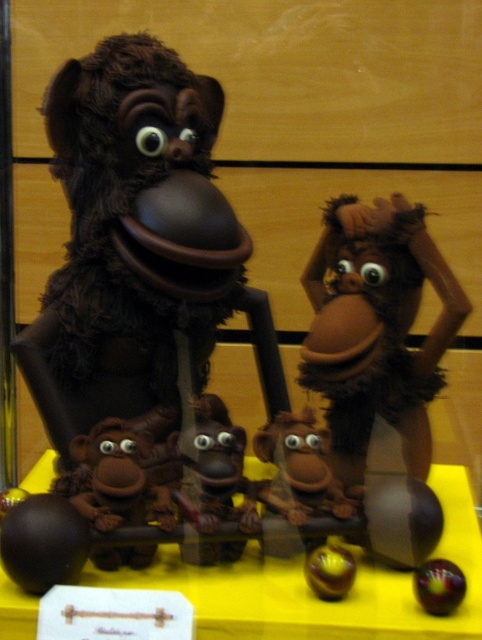
You are setting up a small display on the yellow matte table at center. You have a shiny purple ball at center that you want to place on the table. Considering the table and ball sizes, will the ball fit entirely on the table without hanging over the edges?

The yellow matte table at center is wider than the shiny purple ball at center, so the ball will fit entirely on the table without hanging over the edges.

You are a customer at a chocolate shop and see the yellow matte table at center and the shiny purple ball at center. Which object is positioned higher in the display?

The yellow matte table at center is located above the shiny purple ball at center, so it is positioned higher in the display.